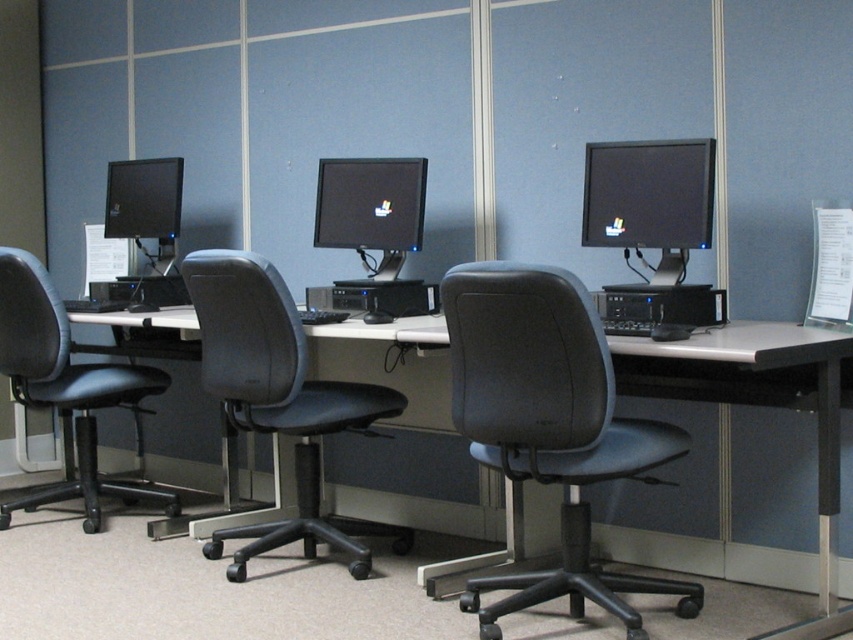
Between black plastic desk at center and black leather swivel chair at left, which one appears on the right side from the viewer's perspective?

Positioned to the right is black plastic desk at center.

Which is below, black plastic desk at center or black leather swivel chair at left?

black plastic desk at center

Who is more forward, (534, 492) or (76, 401)?

Point (534, 492) is in front.

Locate an element on the screen. black plastic desk at center is located at coordinates (761, 404).

Does black leather swivel chair at center appear on the left side of matte black monitor at center?

Indeed, black leather swivel chair at center is positioned on the left side of matte black monitor at center.

Consider the image. Which of these two, black leather swivel chair at center or matte black monitor at center, stands taller?

With more height is black leather swivel chair at center.

Which is behind, point (231, 570) or point (418, 163)?

Point (418, 163)

Image resolution: width=853 pixels, height=640 pixels. I want to click on black leather swivel chair at center, so click(x=279, y=400).

Does gray leather swivel chair at center appear on the left side of matte black monitor at center?

No, gray leather swivel chair at center is not to the left of matte black monitor at center.

Is gray leather swivel chair at center bigger than matte black monitor at center?

Yes.

Where is `gray leather swivel chair at center`? This screenshot has height=640, width=853. gray leather swivel chair at center is located at coordinates (548, 426).